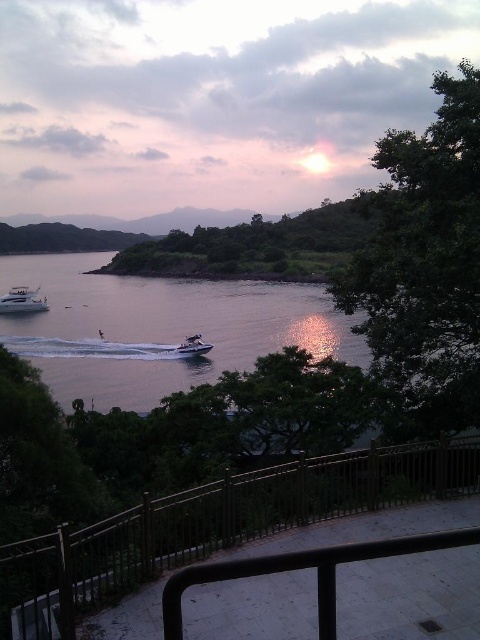
Where is `white glossy yacht at lower left`? This screenshot has width=480, height=640. white glossy yacht at lower left is located at coordinates (23, 301).

Is point (36, 288) closer to viewer compared to point (188, 356)?

No, it is not.

Image resolution: width=480 pixels, height=640 pixels. Find the location of `white glossy yacht at lower left`. white glossy yacht at lower left is located at coordinates (23, 301).

Does metallic rail at center appear on the right side of clear water at lower left?

Correct, you'll find metallic rail at center to the right of clear water at lower left.

Which of these two, metallic rail at center or clear water at lower left, stands taller?

With more height is clear water at lower left.

Which is behind, point (228, 540) or point (120, 284)?

Point (120, 284)

You are a GUI agent. You are given a task and a screenshot of the screen. Output one action in this format:
    pyautogui.click(x=<x>, y=<y>)
    Task: Click on the metallic rail at center
    
    Given the screenshot: What is the action you would take?
    pyautogui.click(x=214, y=525)

Which is below, clear water at lower left or metallic silver jet ski at center?

metallic silver jet ski at center is lower down.

Between clear water at lower left and metallic silver jet ski at center, which one appears on the left side from the viewer's perspective?

clear water at lower left

Between point (155, 362) and point (194, 348), which one is positioned in front?

Positioned in front is point (194, 348).

Locate an element on the screen. clear water at lower left is located at coordinates click(158, 326).